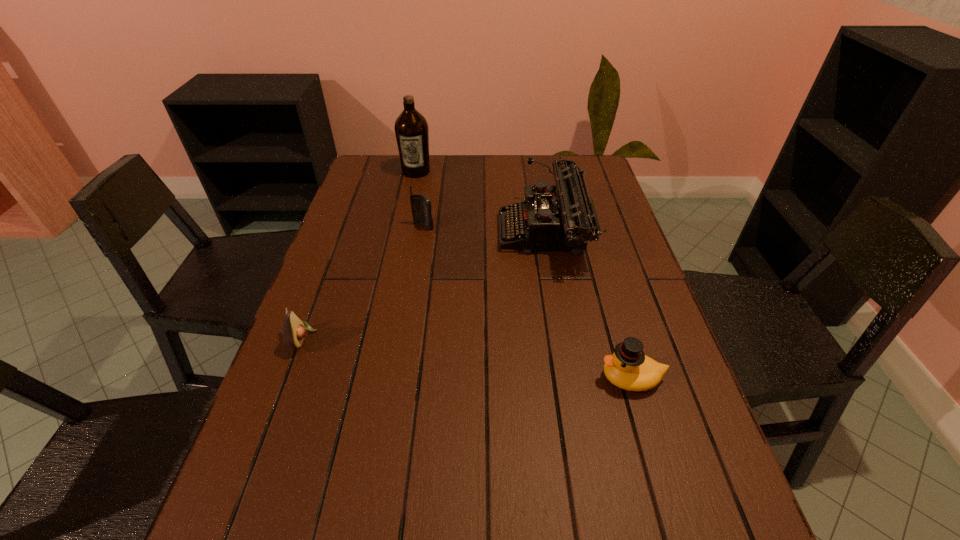
I want to click on blank space located 0.280m on the keyboard of the typewriter, so click(404, 234).

The width and height of the screenshot is (960, 540). I want to click on vacant space located 0.100m on the keyboard of the cellular telephone, so click(x=420, y=252).

Locate an element on the screen. The width and height of the screenshot is (960, 540). free spot located on the front-facing side of the nearest object is located at coordinates (431, 378).

At what (x,y) coordinates should I click in order to perform the action: click on blank space located 0.120m on the front-facing side of the nearest object. Please return your answer as a coordinate pair (x, y). Looking at the image, I should click on (542, 378).

You are a GUI agent. You are given a task and a screenshot of the screen. Output one action in this format:
    pyautogui.click(x=<x>, y=<y>)
    Task: Click on the free location located 0.200m on the front-facing side of the nearest object
    
    Given the screenshot: What is the action you would take?
    pyautogui.click(x=506, y=378)

Where is `free space located on the seed side of the leftmost object`? The image size is (960, 540). free space located on the seed side of the leftmost object is located at coordinates (348, 338).

This screenshot has height=540, width=960. In order to click on object situated at the far edge in this screenshot , I will do `click(411, 128)`.

Locate an element on the screen. This screenshot has width=960, height=540. olive oil that is positioned at the left edge is located at coordinates (411, 128).

The image size is (960, 540). Find the location of `avocado positioned at the left edge`. avocado positioned at the left edge is located at coordinates (294, 330).

What are the coordinates of `typewriter situated at the right edge` in the screenshot? It's located at (563, 217).